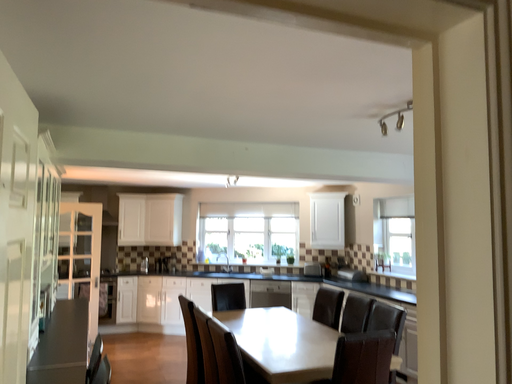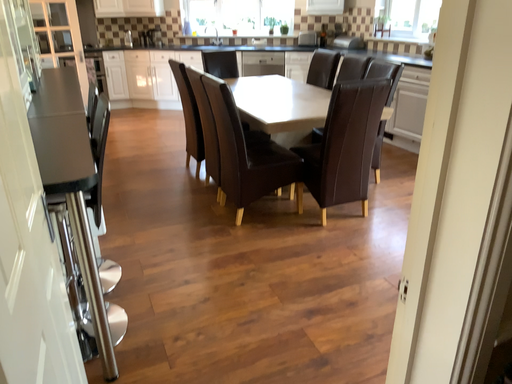
Question: How did the camera likely rotate when shooting the video?

Choices:
 (A) rotated upward
 (B) rotated downward

Answer: (B)